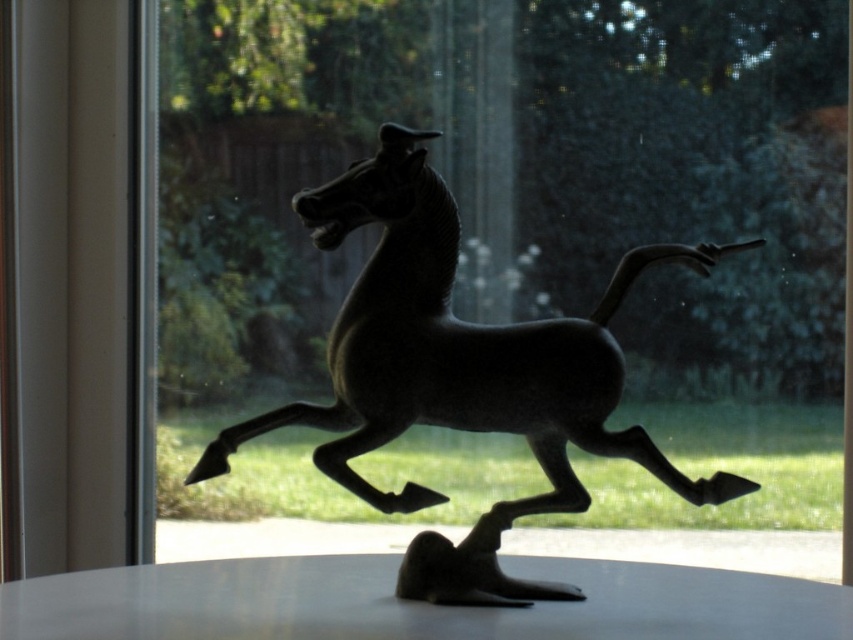
Question: Considering the relative positions of shiny bronze horse at center and white glossy table at center in the image provided, where is shiny bronze horse at center located with respect to white glossy table at center?

Choices:
 (A) right
 (B) left

Answer: (A)

Question: Is shiny bronze horse at center to the right of white glossy table at center from the viewer's perspective?

Choices:
 (A) no
 (B) yes

Answer: (B)

Question: Which point is farther to the camera?

Choices:
 (A) (502, 525)
 (B) (280, 604)

Answer: (A)

Question: Does shiny bronze horse at center appear over white glossy table at center?

Choices:
 (A) yes
 (B) no

Answer: (A)

Question: Which point is farther from the camera taking this photo?

Choices:
 (A) (125, 573)
 (B) (438, 188)

Answer: (A)